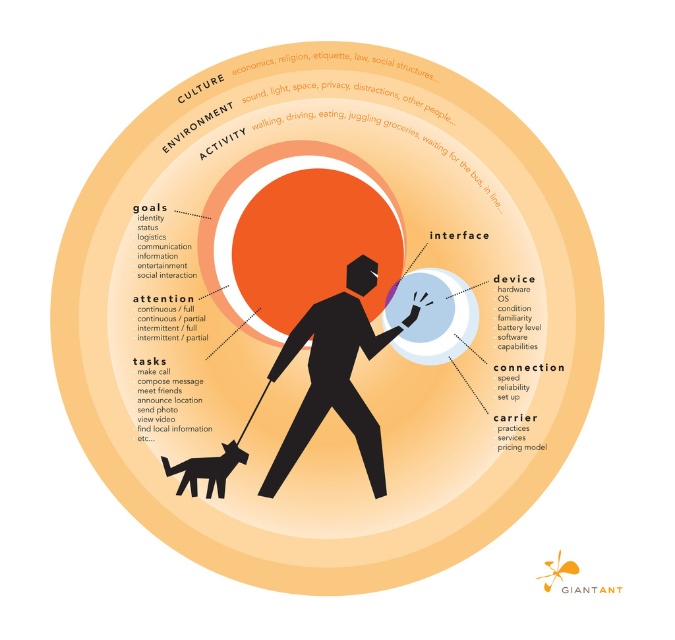
Question: From the image, what is the correct spatial relationship of transparent glass sphere at center in relation to transparent plastic bubble at center?

Choices:
 (A) above
 (B) below

Answer: (B)

Question: Does black matte figure at center appear on the right side of transparent plastic bubble at center?

Choices:
 (A) yes
 (B) no

Answer: (B)

Question: Which point appears farthest from the camera in this image?

Choices:
 (A) (256, 227)
 (B) (207, 472)
 (C) (313, 316)

Answer: (C)

Question: Which point appears farthest from the camera in this image?

Choices:
 (A) (387, 312)
 (B) (378, 288)

Answer: (B)

Question: From the image, what is the correct spatial relationship of transparent glass sphere at center in relation to orange matte circle at center?

Choices:
 (A) above
 (B) below

Answer: (B)

Question: Which point appears farthest from the camera in this image?

Choices:
 (A) (319, 364)
 (B) (286, 161)
 (C) (165, 468)

Answer: (A)